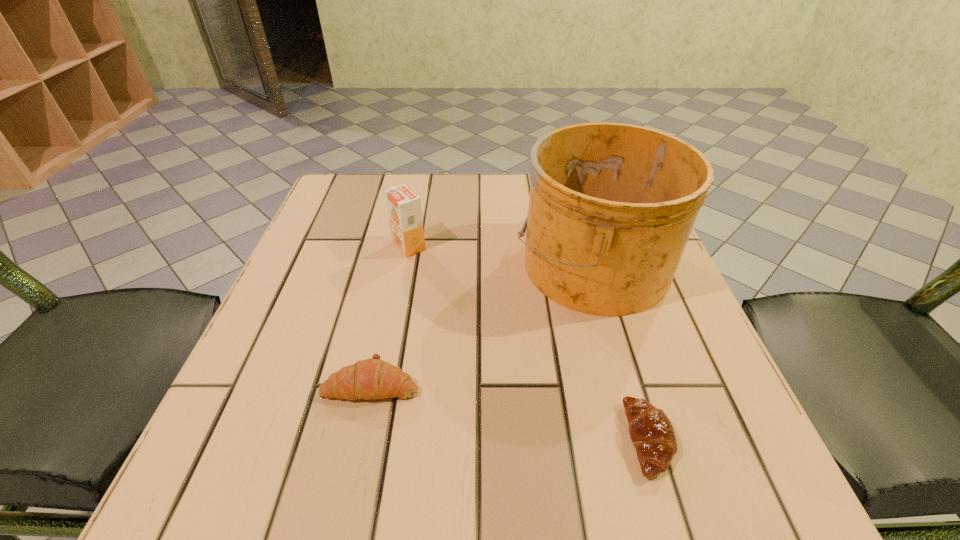
Find the location of `the tallest object`. the tallest object is located at coordinates (611, 207).

The width and height of the screenshot is (960, 540). I want to click on orange juice, so click(404, 206).

The height and width of the screenshot is (540, 960). Find the location of `the left crescent roll`. the left crescent roll is located at coordinates (373, 378).

Where is `the right crescent roll`? The image size is (960, 540). the right crescent roll is located at coordinates (651, 432).

Locate an element on the screen. The image size is (960, 540). vacant space positioned 0.240m on the left of the bucket is located at coordinates tap(396, 264).

Locate an element on the screen. vacant space situated on the right of the second tallest object is located at coordinates (483, 246).

You are a GUI agent. You are given a task and a screenshot of the screen. Output one action in this format:
    pyautogui.click(x=<x>, y=<y>)
    Task: Click on the vacant space located on the front of the left crescent roll
    This screenshot has height=540, width=960.
    Given the screenshot: What is the action you would take?
    pyautogui.click(x=352, y=472)

Locate an element on the screen. The image size is (960, 540). free space located 0.270m on the left of the right crescent roll is located at coordinates (432, 440).

Locate an element on the screen. object located at the far edge is located at coordinates (611, 207).

Identify the location of object located in the near edge section of the desktop. (651, 432).